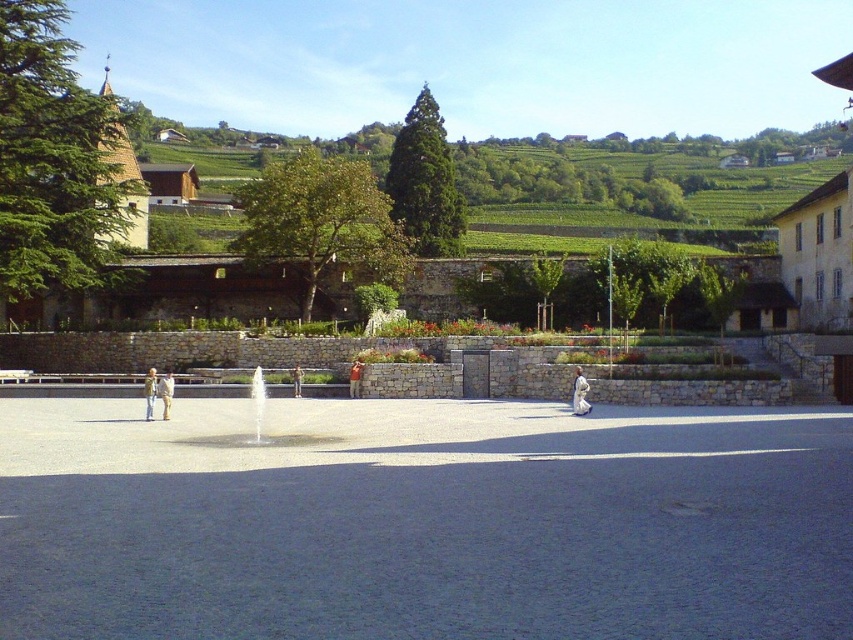
Question: Which object is the farthest from the white marble fountain at center?

Choices:
 (A) light beige fabric jacket at left
 (B) denim jacket at center

Answer: (B)

Question: Can you confirm if white marble fountain at center is positioned below light beige fabric jacket at left?

Choices:
 (A) no
 (B) yes

Answer: (B)

Question: Based on their relative distances, which object is nearer to the white marble fountain at center?

Choices:
 (A) light brown leather jacket at center
 (B) denim jacket at center
 (C) gray concrete courtyard at center

Answer: (B)

Question: Which point appears closest to the camera in this image?

Choices:
 (A) (167, 374)
 (B) (149, 419)

Answer: (B)

Question: Does gray concrete courtyard at center have a larger size compared to denim jacket at center?

Choices:
 (A) no
 (B) yes

Answer: (B)

Question: Considering the relative positions of white cotton jacket at lower right and light beige fabric jacket at left in the image provided, where is white cotton jacket at lower right located with respect to light beige fabric jacket at left?

Choices:
 (A) right
 (B) left

Answer: (A)